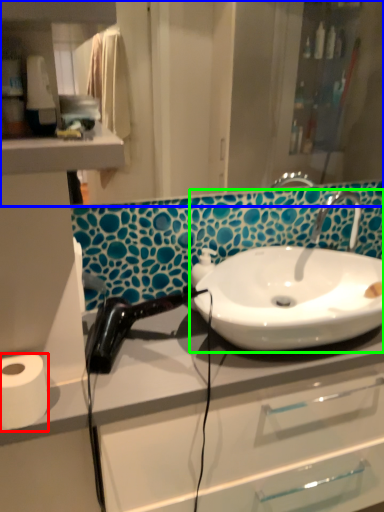
Question: Which object is positioned closest to toilet paper (highlighted by a red box)? Select from mirror (highlighted by a blue box) and sink (highlighted by a green box).

Choices:
 (A) mirror
 (B) sink

Answer: (B)